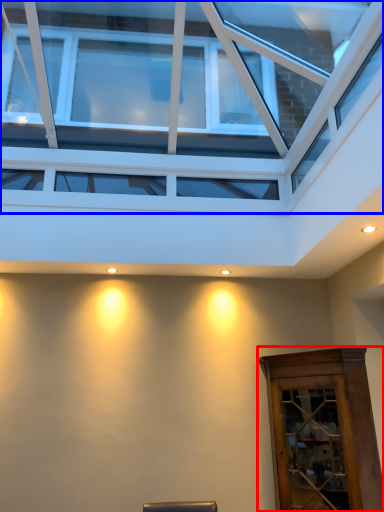
Question: Among these objects, which one is farthest to the camera, elevator (highlighted by a red box) or window (highlighted by a blue box)?

Choices:
 (A) elevator
 (B) window

Answer: (A)